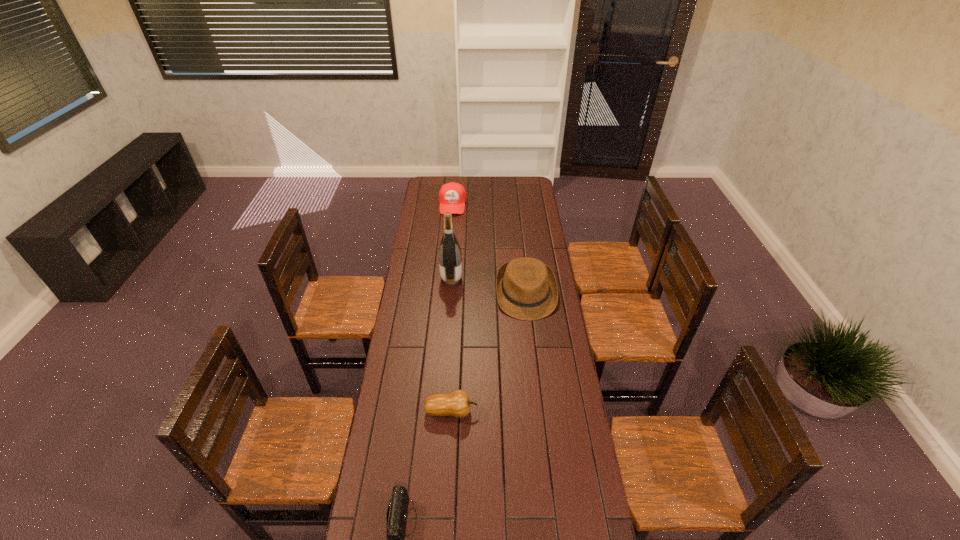
You are a GUI agent. You are given a task and a screenshot of the screen. Output one action in this format:
    pyautogui.click(x=<x>, y=<y>)
    Task: Click on the wine bottle
    The image size is (960, 540).
    Given the screenshot: What is the action you would take?
    [450, 258]

Locate an element on the screen. This screenshot has width=960, height=540. baseball cap is located at coordinates (452, 196).

Identify the location of fedora. (526, 288).

Find the location of a particular element. This screenshot has height=540, width=960. gourd is located at coordinates (457, 403).

Locate an element on the screen. The width and height of the screenshot is (960, 540). free spot located on the label of the tallest object is located at coordinates (478, 279).

At what (x,y) coordinates should I click in order to perform the action: click on vacant space located on the front panel of the farthest object. Please return your answer as a coordinate pair (x, y). This screenshot has height=540, width=960. Looking at the image, I should click on (449, 247).

The width and height of the screenshot is (960, 540). In order to click on blank space located 0.290m on the front-facing side of the fedora in this screenshot , I will do `click(535, 374)`.

What are the coordinates of `vacant space located on the stem side of the fourth farthest object` in the screenshot? It's located at (546, 411).

Where is `object present at the far edge`? object present at the far edge is located at coordinates (452, 196).

Identify the location of object present at the left edge. (452, 196).